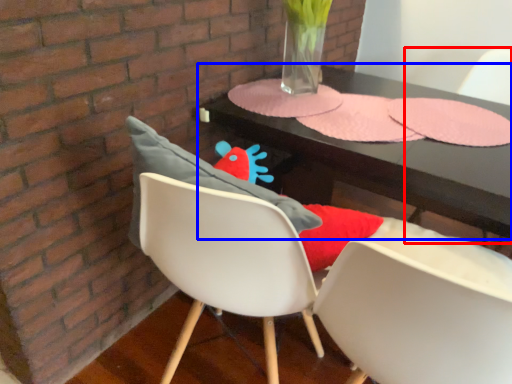
Question: Which object appears farthest to the camera in this image, armchair (highlighted by a red box) or table (highlighted by a blue box)?

Choices:
 (A) armchair
 (B) table

Answer: (A)